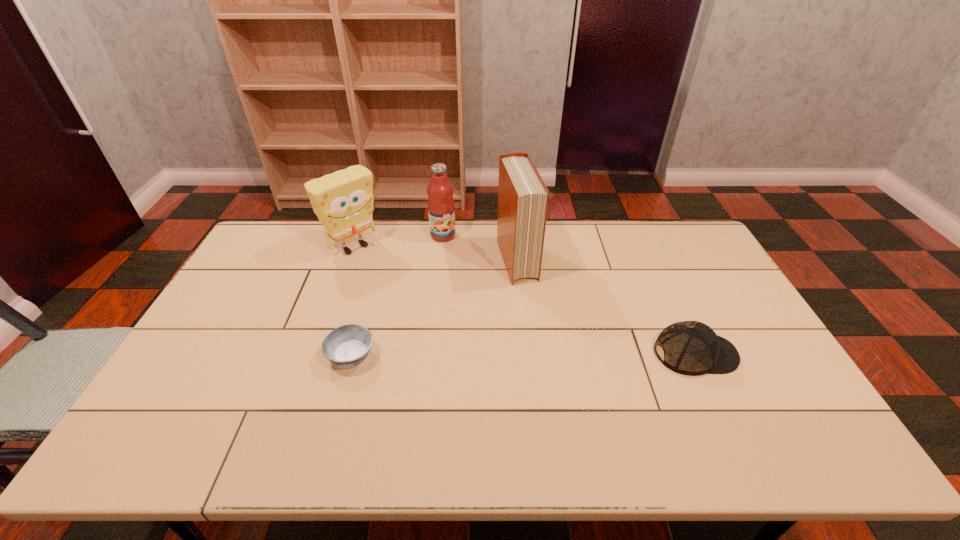
You are a GUI agent. You are given a task and a screenshot of the screen. Output one action in this format:
    pyautogui.click(x=<x>, y=<y>)
    Task: Click on the closest object to the rightmost object
    Image resolution: width=960 pixels, height=540 pixels.
    Given the screenshot: What is the action you would take?
    pyautogui.click(x=523, y=197)

Locate an element on the screen. The height and width of the screenshot is (540, 960). vacant position in the image that satisfies the following two spatial constraints: 1. on the back side of the shortest object; 2. on the left side of the third object from right to left is located at coordinates click(x=385, y=235).

The width and height of the screenshot is (960, 540). Find the location of `free spot that satisfies the following two spatial constraints: 1. on the front side of the sponge; 2. on the front-facing side of the cap`. free spot that satisfies the following two spatial constraints: 1. on the front side of the sponge; 2. on the front-facing side of the cap is located at coordinates (316, 354).

The image size is (960, 540). I want to click on vacant space that satisfies the following two spatial constraints: 1. on the front side of the second object from right to left; 2. on the right side of the third object from left to right, so click(x=441, y=260).

Image resolution: width=960 pixels, height=540 pixels. I want to click on free location that satisfies the following two spatial constraints: 1. on the back side of the third object from right to left; 2. on the right side of the sponge, so click(x=358, y=235).